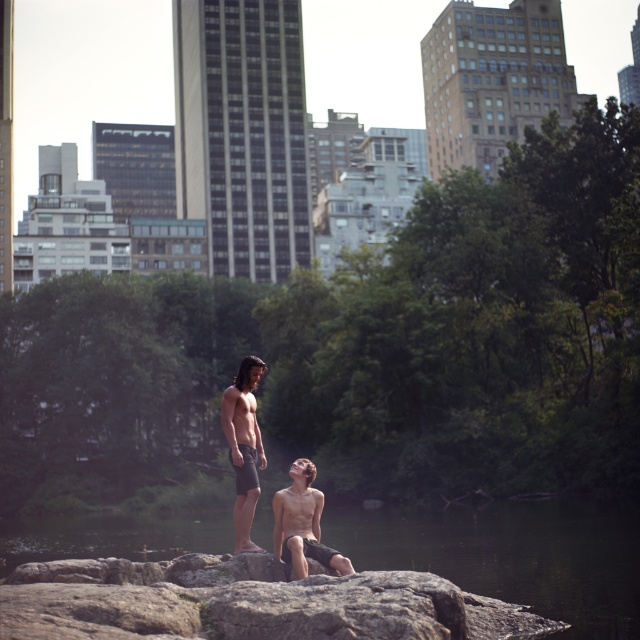
You are a photographer standing in the park and want to take a photo of both the dark gray stone river at center and the smooth skin woman at center. Which object should you focus on first to ensure it appears sharp in the photo?

The dark gray stone river at center is further to the viewer than the smooth skin woman at center, so you should focus on the dark gray stone river at center first to ensure both are in focus.

You are standing at the edge of the dark gray stone river at center. You want to reach the point marked as point (513, 554). Is this point located on the river or on the surrounding rocks?

The point (513, 554) is on the dark gray stone river at center, so it is located on the river.